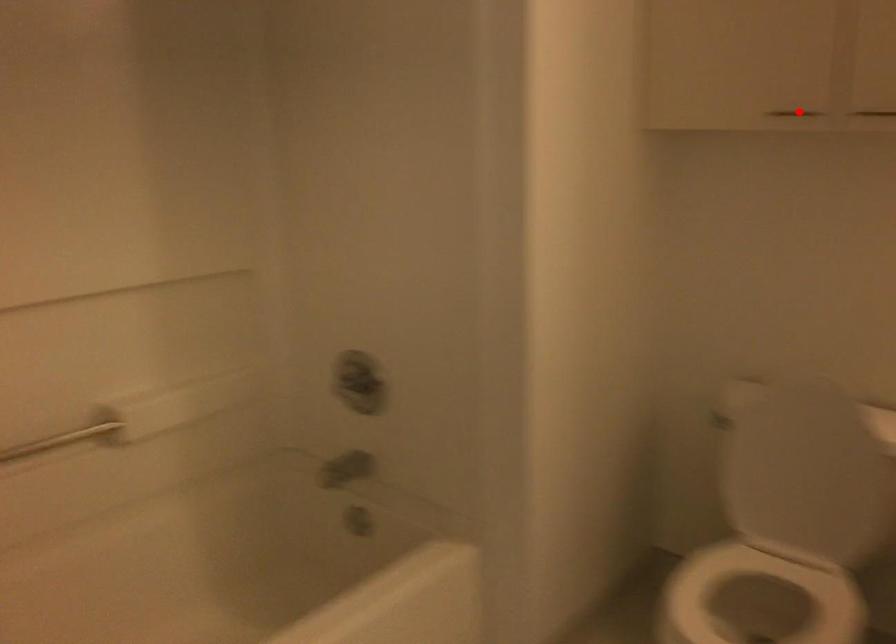
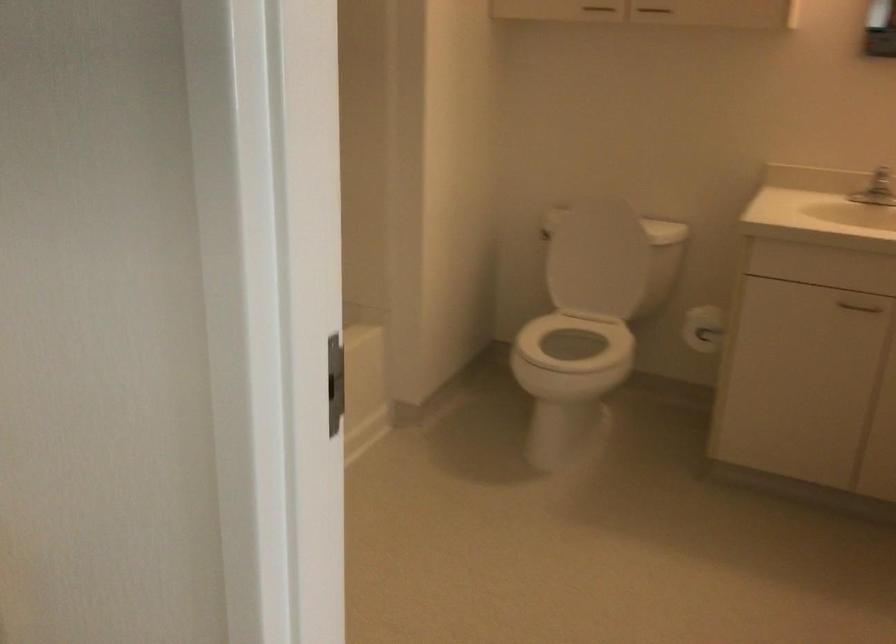
In the second image, find the point that corresponds to the highlighted location in the first image.

(599, 8)